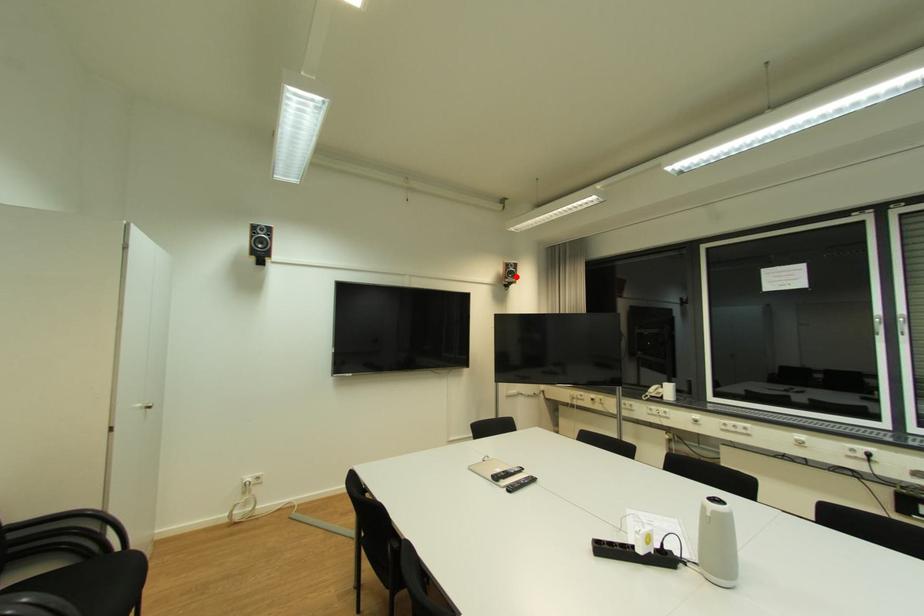
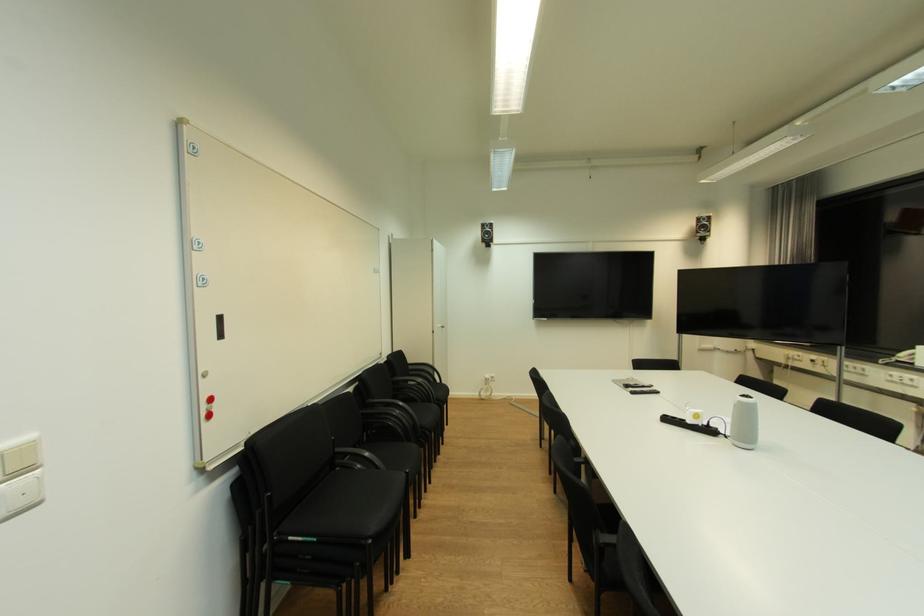
The point at the highlighted location is marked in the first image. Where is the corresponding point in the second image?

(708, 231)